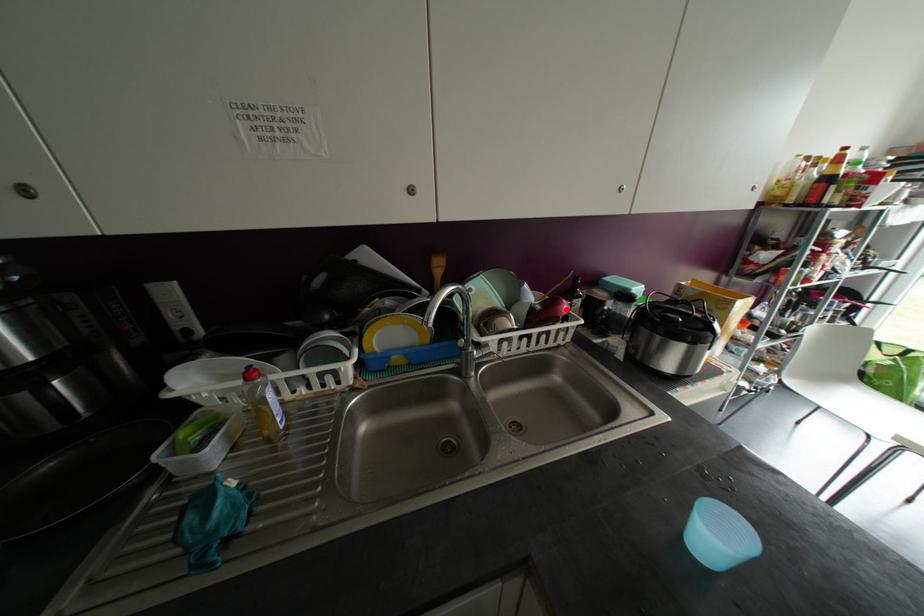
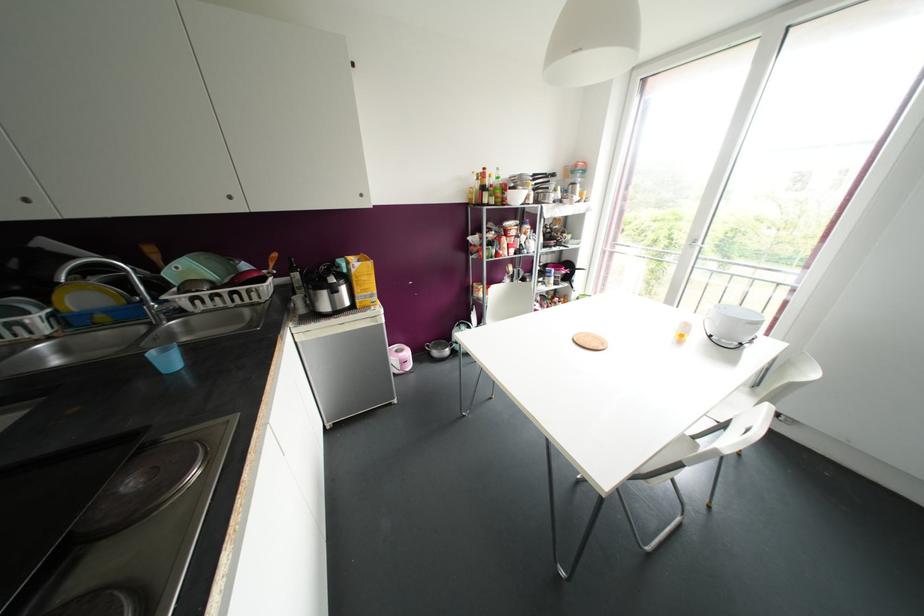
Where in the second image is the point corresponding to the highlighted location from the first image?

(251, 277)